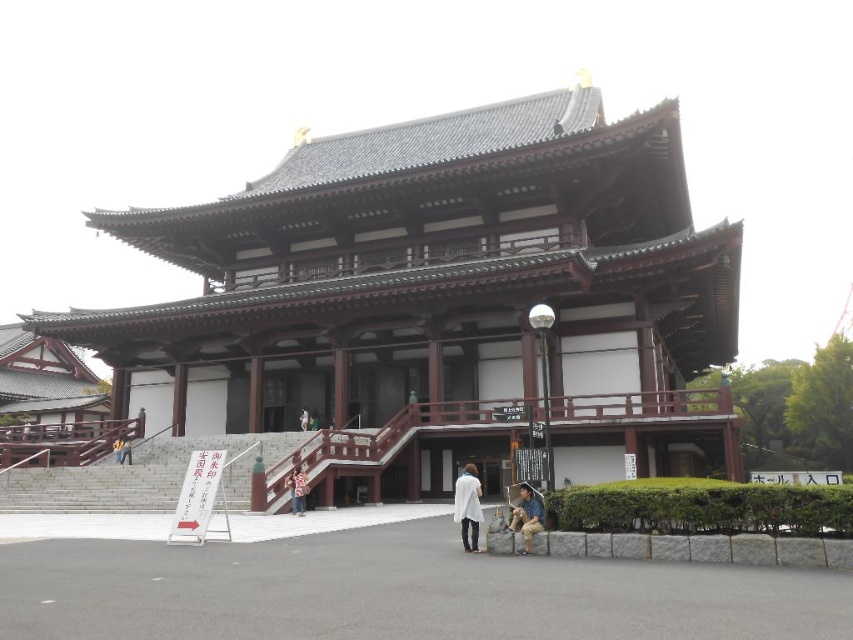
Between white matte coat at center and white fabric bag at center, which one appears on the right side from the viewer's perspective?

white matte coat at center

Does white matte coat at center lie behind white fabric bag at center?

No.

Which is behind, point (480, 518) or point (299, 419)?

The point (299, 419) is behind.

Where is `white matte coat at center`? white matte coat at center is located at coordinates (467, 506).

Can you confirm if light brown wooden sign at center is bigger than white fabric bag at center?

Correct, light brown wooden sign at center is larger in size than white fabric bag at center.

Does point (128, 449) come behind point (303, 428)?

No.

What do you see at coordinates (125, 451) in the screenshot? I see `light brown wooden sign at center` at bounding box center [125, 451].

This screenshot has width=853, height=640. Identify the location of light brown wooden sign at center. (125, 451).

Can you confirm if wooden temple at center is smaller than white fabric bag at center?

No, wooden temple at center is not smaller than white fabric bag at center.

This screenshot has width=853, height=640. Identify the location of wooden temple at center. (440, 298).

The image size is (853, 640). I want to click on wooden temple at center, so click(440, 298).